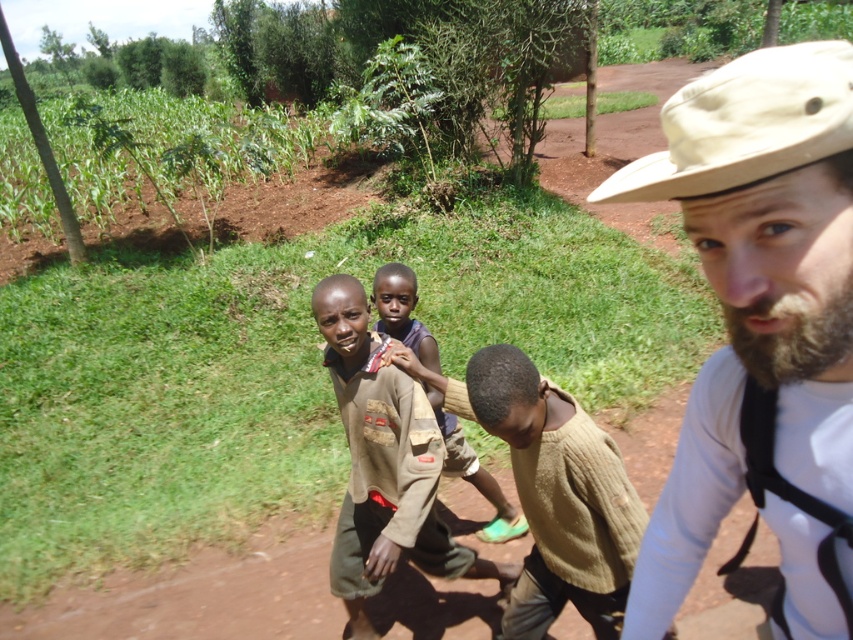
You are a tailor who needs to determine which sweater requires more fabric for a new order. Based on the image, which sweater between the knitted beige sweater at center and the brown knitted sweater at center would need more fabric?

The brown knitted sweater at center requires more fabric because it has a greater width than the knitted beige sweater at center.

You are a photographer trying to capture a clear shot of the brown knitted sweater at center. However, the beige fabric hat at upper right is blocking your view. Can you adjust your position to see the sweater without the hat obstructing it?

The beige fabric hat at upper right is in front of the brown knitted sweater at center, so moving your camera position slightly backward or to the side might allow you to see the sweater without the hat blocking it.

Looking at this image, you are a photographer trying to capture a shot of the brown knitted sweater at center and the beige fabric hat at upper right. Which object is located to the right of the other?

The beige fabric hat at upper right is positioned on the right side of brown knitted sweater at center.